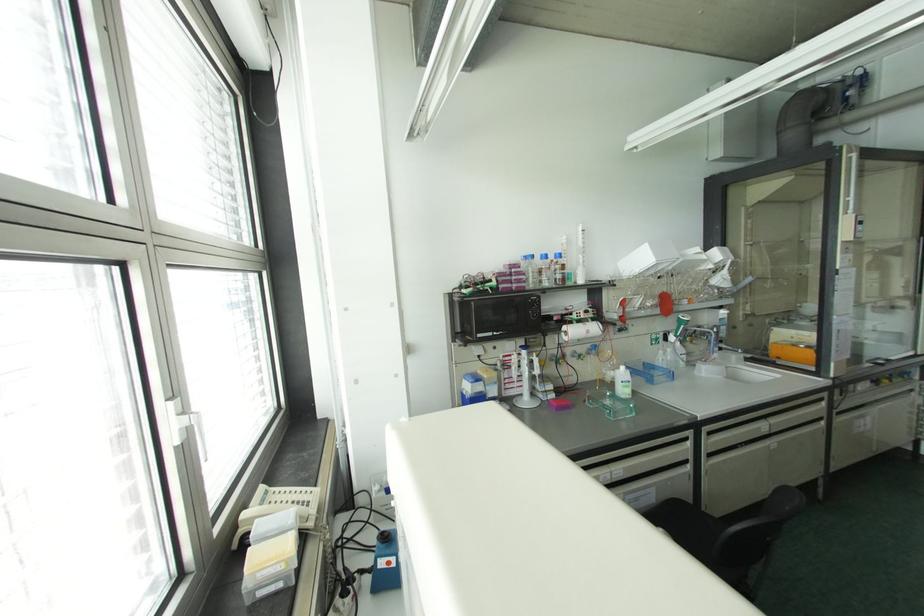
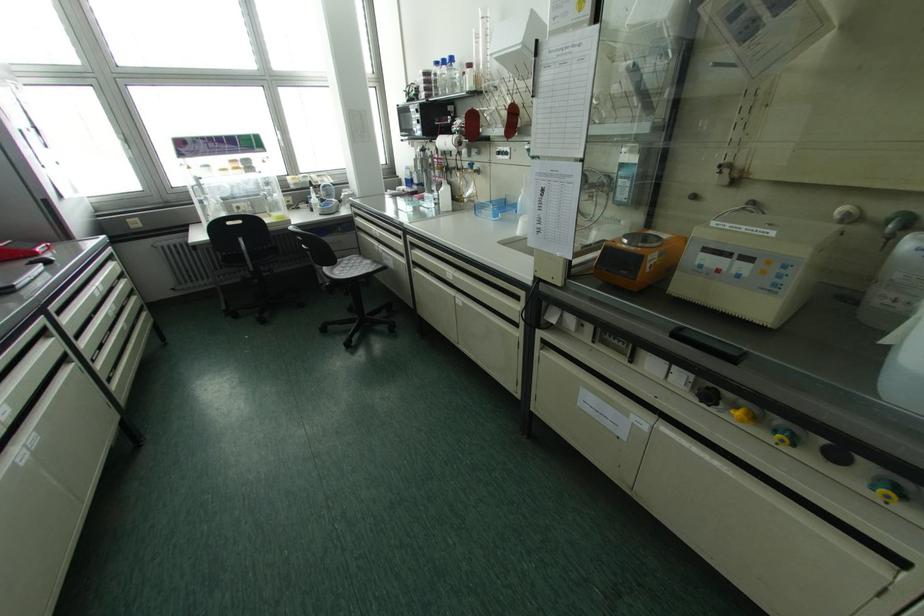
In the second image, find the point that corresponds to point (618, 330) in the first image.

(497, 153)